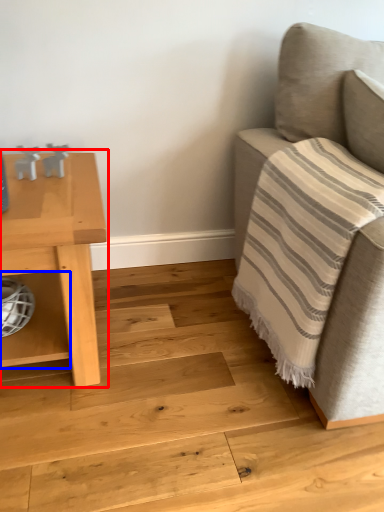
Question: Which object appears farthest to the camera in this image, table (highlighted by a red box) or shelf (highlighted by a blue box)?

Choices:
 (A) table
 (B) shelf

Answer: (B)